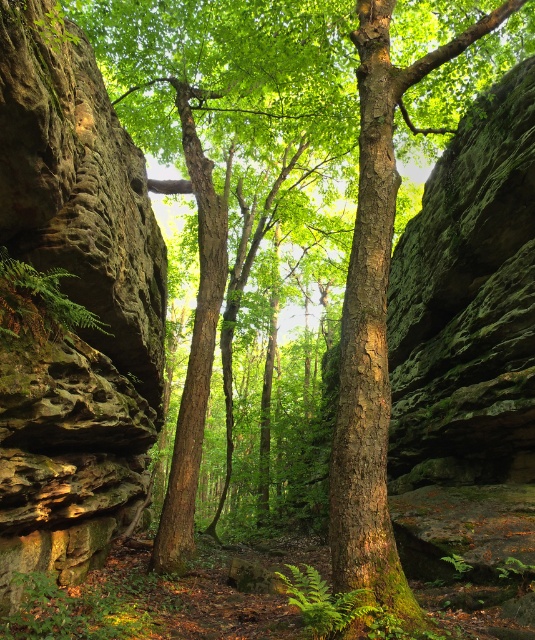
Can you confirm if rough textured rock at left is smaller than green mossy fern at left?

Yes.

Is point (139, 211) positioned in front of point (3, 317)?

No, it is not.

The height and width of the screenshot is (640, 535). In order to click on rough textured rock at left in this screenshot , I will do `click(74, 300)`.